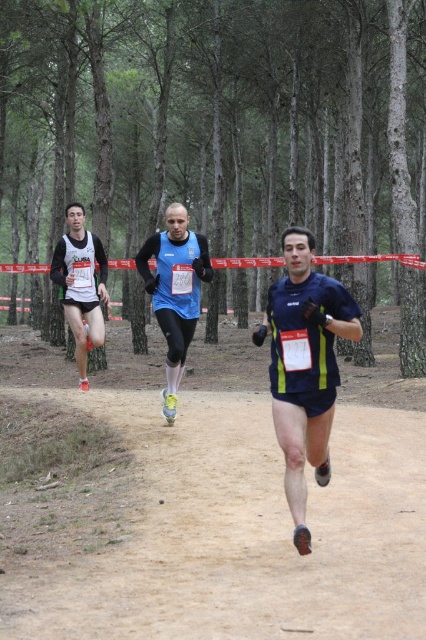
Does green matte trees at center have a larger size compared to dark blue athletic shorts at center?

Indeed, green matte trees at center has a larger size compared to dark blue athletic shorts at center.

Does green matte trees at center have a lesser height compared to dark blue athletic shorts at center?

Incorrect, green matte trees at center's height does not fall short of dark blue athletic shorts at center's.

Does point (181, 76) come closer to viewer compared to point (296, 257)?

No, it is behind (296, 257).

This screenshot has height=640, width=426. Identify the location of green matte trees at center. tap(213, 138).

Between point (336, 376) and point (69, 305), which one is positioned behind?

The point (69, 305) is behind.

Who is more forward, (324, 276) or (83, 298)?

Point (324, 276)

The height and width of the screenshot is (640, 426). Identify the location of dark blue athletic shorts at center. (305, 365).

Which is in front, point (345, 6) or point (169, 216)?

Point (169, 216) is in front.

Between green matte trees at center and blue fabric running suit at center, which one is positioned higher?

green matte trees at center is above.

Does point (224, 102) lie behind point (193, 252)?

That is True.

You are a GUI agent. You are given a task and a screenshot of the screen. Output one action in this format:
    pyautogui.click(x=<x>, y=<y>)
    Task: Click on the green matte trees at center
    
    Given the screenshot: What is the action you would take?
    pyautogui.click(x=213, y=138)